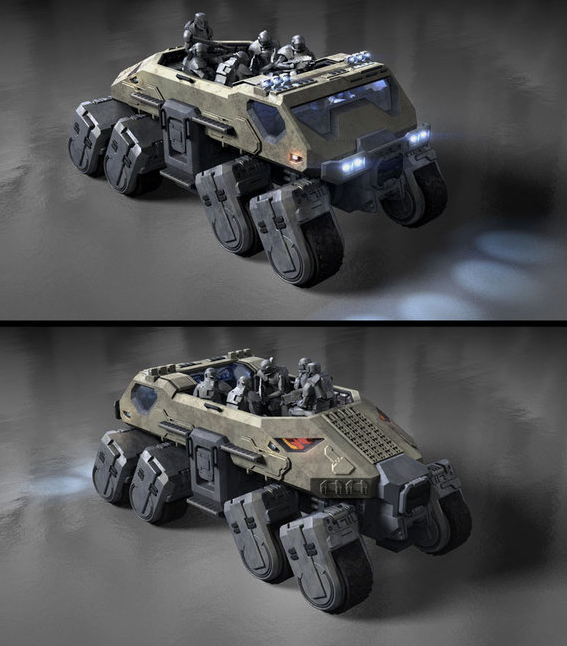
I want to click on toy, so click(x=235, y=120), click(x=266, y=442).